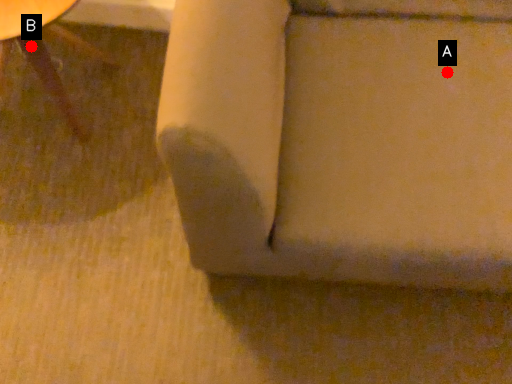
Question: Two points are circled on the image, labeled by A and B beside each circle. Which point is closer to the camera taking this photo?

Choices:
 (A) A is closer
 (B) B is closer

Answer: (A)